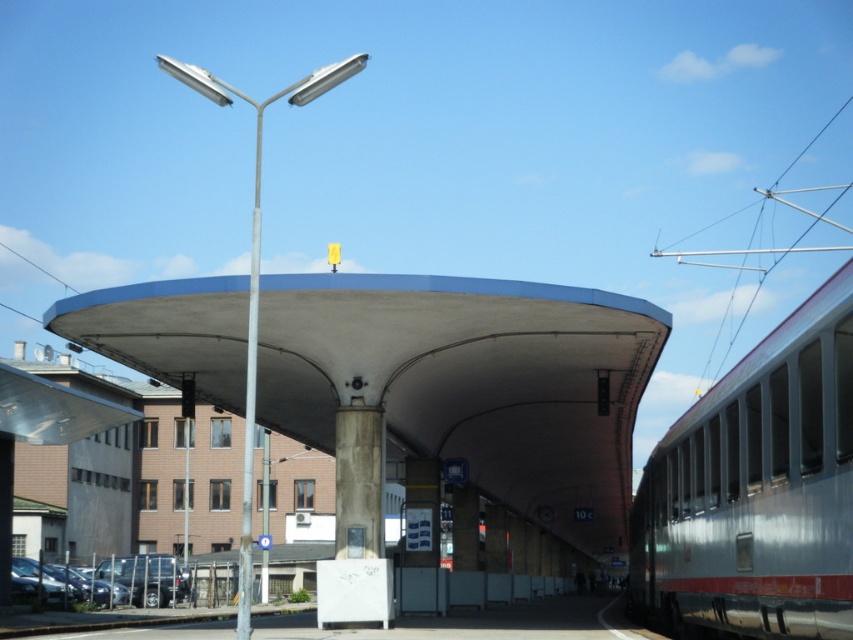
Who is positioned more to the left, concrete/smooth canopy at center or silver metallic train at right?

Positioned to the left is concrete/smooth canopy at center.

Is concrete/smooth canopy at center further to camera compared to silver metallic train at right?

Yes, concrete/smooth canopy at center is further from the viewer.

I want to click on concrete/smooth canopy at center, so click(x=469, y=381).

Can you confirm if concrete/smooth canopy at center is positioned above metallic pole at left?

No.

Between concrete/smooth canopy at center and metallic pole at left, which one is positioned higher?

metallic pole at left

Describe the element at coordinates (469, 381) in the screenshot. Image resolution: width=853 pixels, height=640 pixels. I see `concrete/smooth canopy at center` at that location.

You are a GUI agent. You are given a task and a screenshot of the screen. Output one action in this format:
    pyautogui.click(x=<x>, y=<y>)
    Task: Click on the concrete/smooth canopy at center
    The image size is (853, 640).
    Given the screenshot: What is the action you would take?
    pyautogui.click(x=469, y=381)

Who is more forward, (850, 356) or (253, 339)?

Point (850, 356) is more forward.

Is point (704, 410) farther from camera compared to point (254, 356)?

Yes, it is.

Where is `silver metallic train at right`? This screenshot has height=640, width=853. silver metallic train at right is located at coordinates (757, 490).